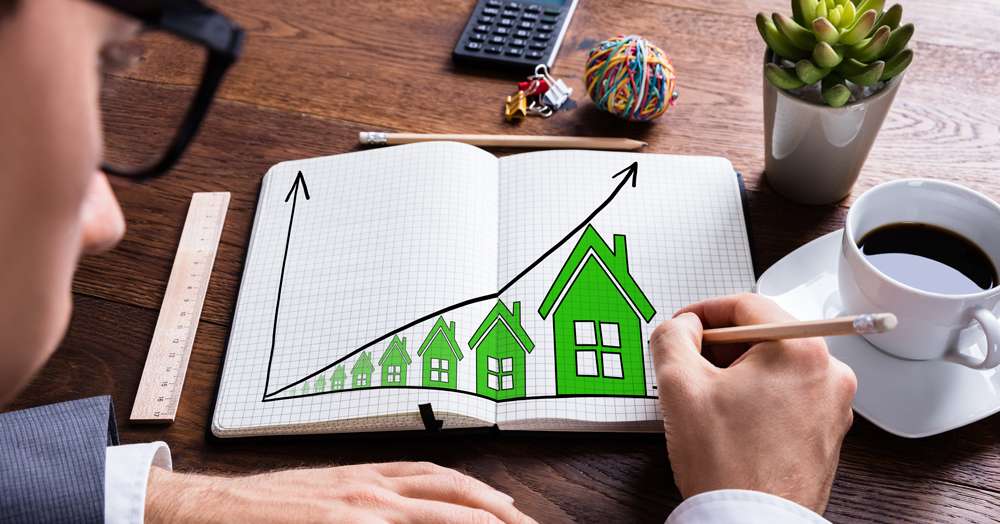
This screenshot has height=524, width=1000. In order to click on pot in this screenshot , I will do `click(819, 162)`.